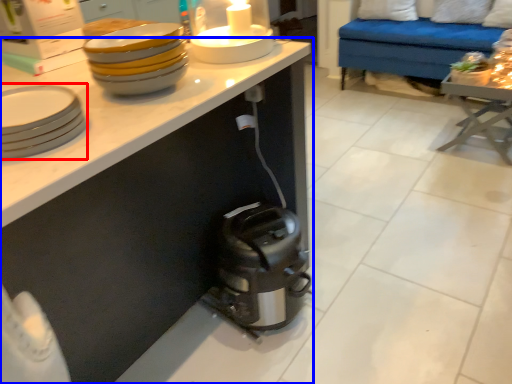
Question: Which object appears farthest to the camera in this image, tableware (highlighted by a red box) or cabinetry (highlighted by a blue box)?

Choices:
 (A) tableware
 (B) cabinetry

Answer: (B)